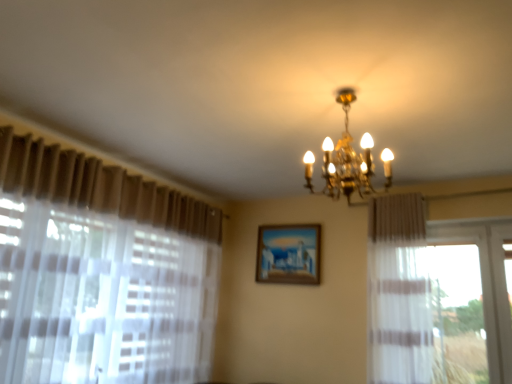
Question: Considering the relative sizes of gold metallic chandelier at upper center and wooden painted picture frame at center in the image provided, is gold metallic chandelier at upper center smaller than wooden painted picture frame at center?

Choices:
 (A) yes
 (B) no

Answer: (B)

Question: Is gold metallic chandelier at upper center positioned with its back to wooden painted picture frame at center?

Choices:
 (A) yes
 (B) no

Answer: (B)

Question: Can you confirm if gold metallic chandelier at upper center is thinner than wooden painted picture frame at center?

Choices:
 (A) no
 (B) yes

Answer: (A)

Question: Does gold metallic chandelier at upper center appear on the left side of wooden painted picture frame at center?

Choices:
 (A) yes
 (B) no

Answer: (B)

Question: From a real-world perspective, is gold metallic chandelier at upper center on top of wooden painted picture frame at center?

Choices:
 (A) yes
 (B) no

Answer: (A)

Question: Is there a large distance between gold metallic chandelier at upper center and wooden painted picture frame at center?

Choices:
 (A) yes
 (B) no

Answer: (A)

Question: From the image's perspective, does wooden painted picture frame at center appear higher than gold metallic chandelier at upper center?

Choices:
 (A) no
 (B) yes

Answer: (A)

Question: Does wooden painted picture frame at center appear on the left side of gold metallic chandelier at upper center?

Choices:
 (A) yes
 (B) no

Answer: (A)

Question: Is wooden painted picture frame at center wider than gold metallic chandelier at upper center?

Choices:
 (A) yes
 (B) no

Answer: (B)

Question: Is wooden painted picture frame at center outside gold metallic chandelier at upper center?

Choices:
 (A) no
 (B) yes

Answer: (B)

Question: Can you confirm if wooden painted picture frame at center is thinner than gold metallic chandelier at upper center?

Choices:
 (A) yes
 (B) no

Answer: (A)

Question: Considering the relative sizes of wooden painted picture frame at center and gold metallic chandelier at upper center in the image provided, is wooden painted picture frame at center smaller than gold metallic chandelier at upper center?

Choices:
 (A) no
 (B) yes

Answer: (B)

Question: Would you say wooden painted picture frame at center is inside or outside gold metallic chandelier at upper center?

Choices:
 (A) inside
 (B) outside

Answer: (B)